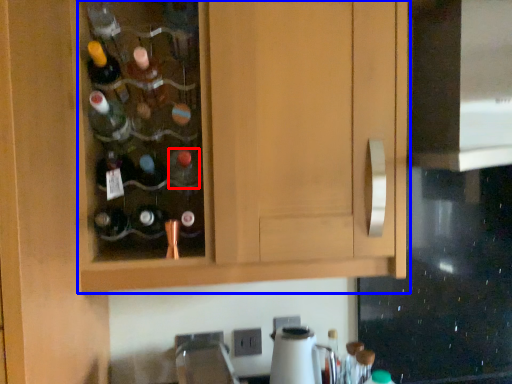
Question: Which point is further to the camera, bottle (highlighted by a red box) or cabinetry (highlighted by a blue box)?

Choices:
 (A) bottle
 (B) cabinetry

Answer: (A)